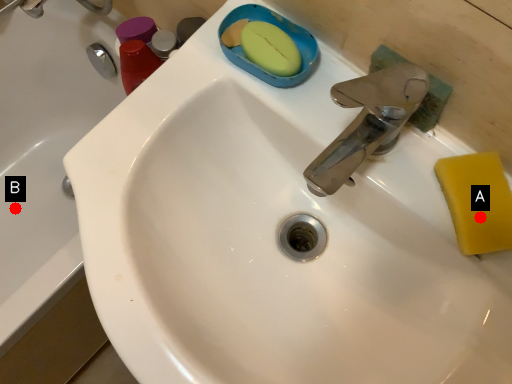
Question: Two points are circled on the image, labeled by A and B beside each circle. Which of the following is the closest to the observer?

Choices:
 (A) A is closer
 (B) B is closer

Answer: (A)